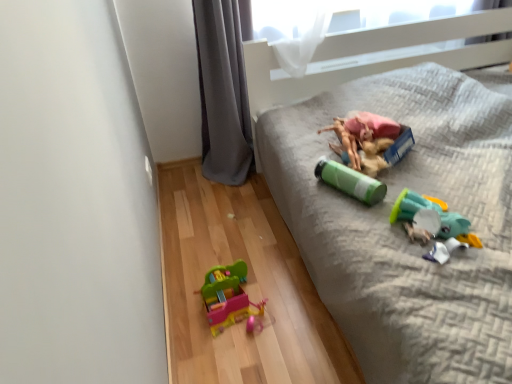
Find the location of a particular element. The height and width of the screenshot is (384, 512). unoccupied region to the right of multicolored plastic toy at lower center, the 4th toy positioned from the top is located at coordinates (294, 302).